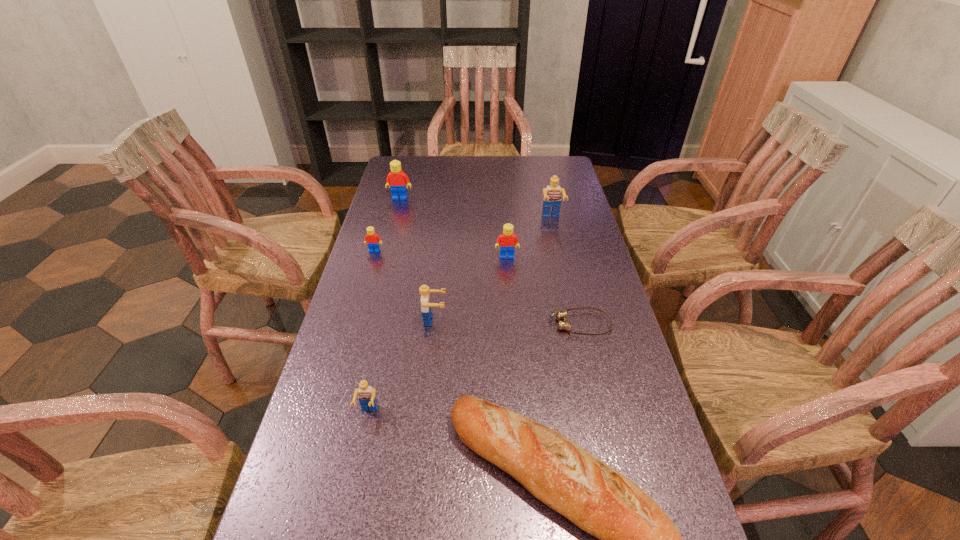
Identify the location of blank region between the nearest Lego and the nearest red Lego. (438, 335).

This screenshot has width=960, height=540. I want to click on free spot between the second blue Lego from left to right and the shortest object, so click(508, 322).

This screenshot has height=540, width=960. I want to click on vacant space that's between the second biggest red Lego and the farthest red Lego, so click(x=453, y=228).

In order to click on vacant area that lies between the smallest red Lego and the rightmost blue Lego in this screenshot , I will do `click(463, 235)`.

The width and height of the screenshot is (960, 540). What are the coordinates of `vacant point located between the goggles and the farthest object` in the screenshot? It's located at (491, 261).

The width and height of the screenshot is (960, 540). What are the coordinates of `free point between the biggest blue Lego and the shortest object` in the screenshot? It's located at point(566,272).

Find the location of a particular element. blank region between the nearest Lego and the fifth nearest object is located at coordinates (438, 335).

Identify which object is located as the third nearest to the nearest Lego. Please provide its 2D coordinates. Your answer should be formatted as a tuple, i.e. [(x, y)], where the tuple contains the x and y coordinates of a point satisfying the conditions above.

[(560, 315)]

This screenshot has width=960, height=540. What are the coordinates of `the second closest object relative to the farthest object` in the screenshot? It's located at (507, 240).

Locate which Lego is the second closest to the shortest object. Please provide its 2D coordinates. Your answer should be formatted as a tuple, i.e. [(x, y)], where the tuple contains the x and y coordinates of a point satisfying the conditions above.

[(427, 315)]